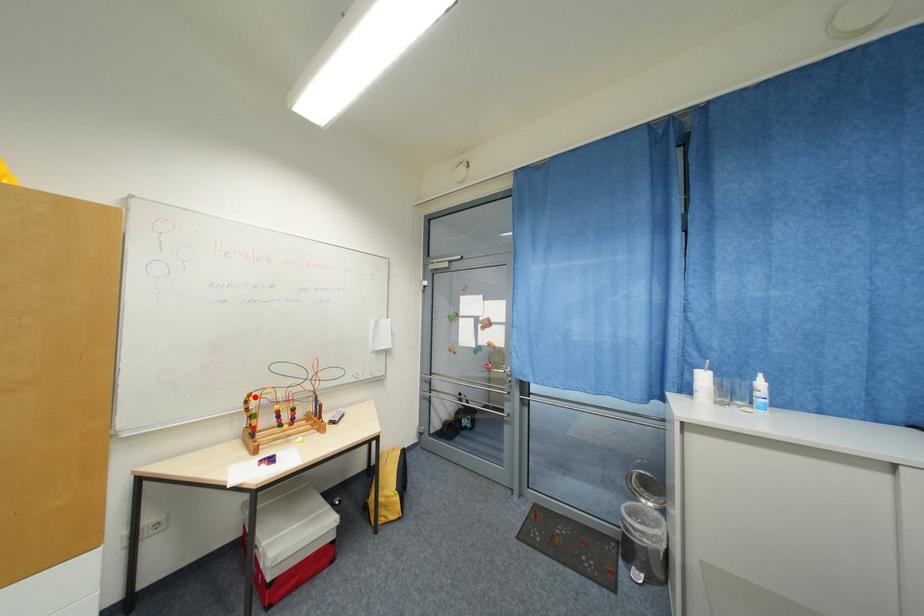
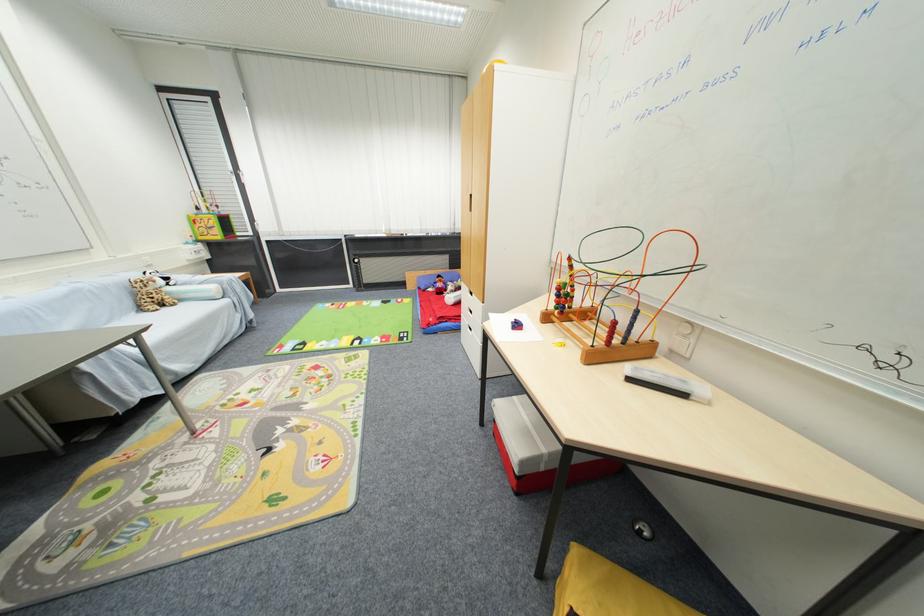
Question: I am providing you with two images of the same scene from different viewpoints. Given a red point in image1, look at the same physical point in image2. Is it:

Choices:
 (A) Closer to the viewpoint
 (B) Farther from the viewpoint

Answer: (A)